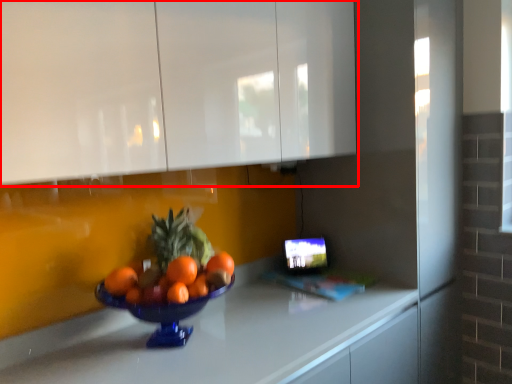
Question: From the image's perspective, what is the correct spatial positioning of cabinetry (annotated by the red box) in reference to countertop?

Choices:
 (A) above
 (B) below

Answer: (A)